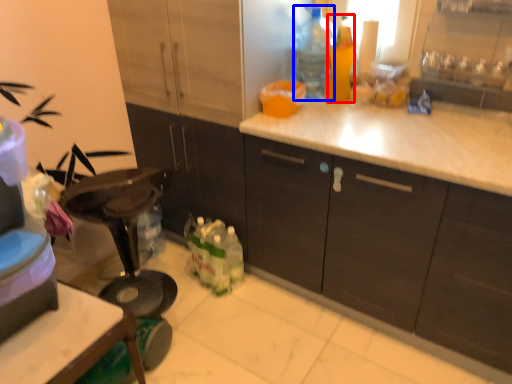
Question: Among these objects, which one is farthest to the camera, bottle (highlighted by a red box) or bottle (highlighted by a blue box)?

Choices:
 (A) bottle
 (B) bottle

Answer: (B)